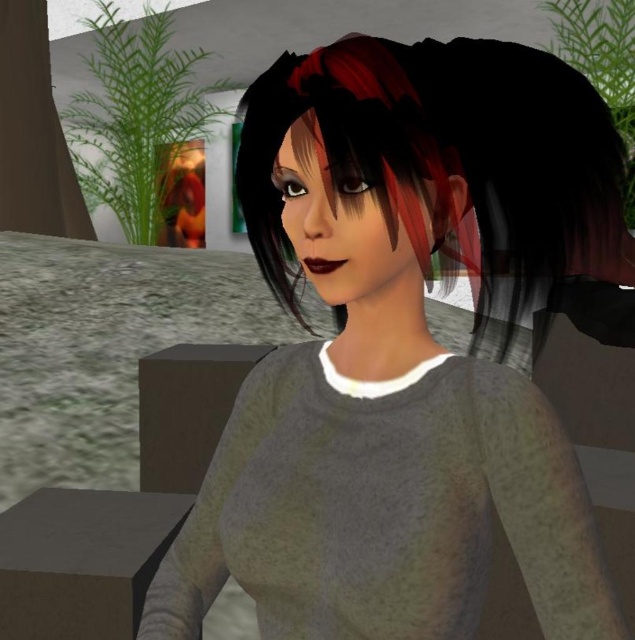
Does gray matte sweater at center have a larger size compared to shiny black hair at center?

Incorrect, gray matte sweater at center is not larger than shiny black hair at center.

Between point (497, 512) and point (415, 193), which one is positioned in front?

Point (415, 193) is more forward.

Describe the element at coordinates (384, 508) in the screenshot. I see `gray matte sweater at center` at that location.

Find the location of a particular element. gray matte sweater at center is located at coordinates (384, 508).

Looking at this image, which is below, matte gray sweater at center or shiny black hair at center?

matte gray sweater at center is lower down.

Which is behind, point (582, 568) or point (613, 260)?

Point (613, 260)

Which is behind, point (478, 88) or point (337, 81)?

The point (478, 88) is behind.

Where is `matte gray sweater at center`? matte gray sweater at center is located at coordinates (404, 346).

Based on the photo, who is higher up, matte gray sweater at center or gray matte sweater at center?

matte gray sweater at center

Which is behind, point (444, 508) or point (411, 512)?

The point (444, 508) is more distant.

Image resolution: width=635 pixels, height=640 pixels. Identify the location of matte gray sweater at center. (404, 346).